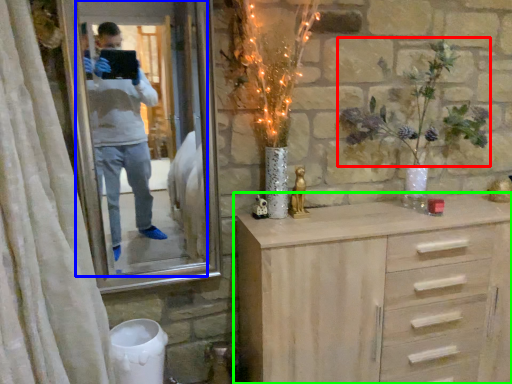
Question: Which object is positioned closest to floral arrangement (highlighted by a red box)? Select from mirror (highlighted by a blue box) and chest of drawers (highlighted by a green box).

Choices:
 (A) mirror
 (B) chest of drawers

Answer: (B)